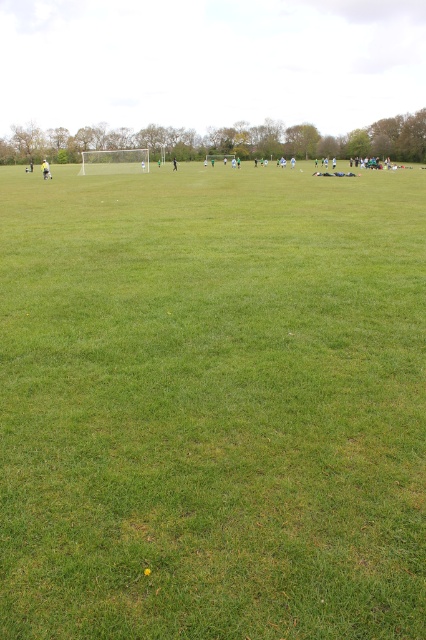
Is green grass field at center thinner than black fabric person at center?

Incorrect, green grass field at center's width is not less than black fabric person at center's.

Which is in front, point (86, 237) or point (173, 168)?

Point (86, 237)

Find the location of a particular element. The image size is (426, 640). green grass field at center is located at coordinates (212, 403).

Is point (48, 164) behind point (175, 164)?

No, it is in front of (175, 164).

Who is more distant from viewer, [48,173] or [172,164]?

Positioned behind is point [172,164].

Is point (43, 166) farther from camera compared to point (172, 161)?

No, (43, 166) is closer to viewer.

Locate an element on the screen. The height and width of the screenshot is (640, 426). light brown leather jacket at left is located at coordinates (46, 170).

Which is in front, point (63, 419) or point (48, 172)?

Point (63, 419) is in front.

Which is below, green grass field at center or light brown leather jacket at left?

green grass field at center is below.

Does point (216, 291) come farther from viewer compared to point (43, 164)?

No, (216, 291) is closer to viewer.

Find the location of `green grass field at center`. green grass field at center is located at coordinates (212, 403).